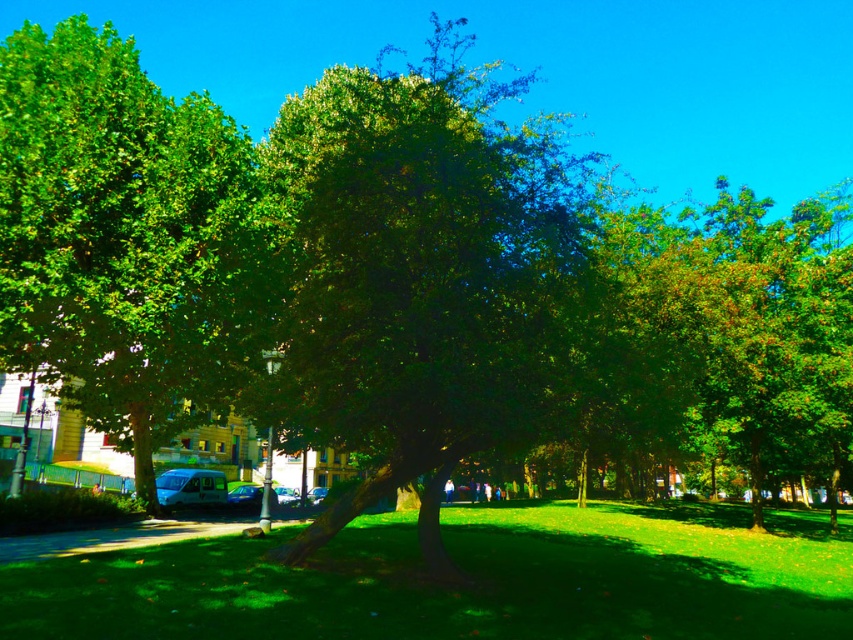
Question: Which object is closer to the camera taking this photo?

Choices:
 (A) green grassy at center
 (B) metallic silver car at center
 (C) green leafy tree at center

Answer: (A)

Question: Which point is closer to the camera?

Choices:
 (A) (236, 288)
 (B) (206, 474)
 (C) (296, 493)

Answer: (A)

Question: Can you confirm if metallic silver van at lower left is positioned to the right of metallic silver car at center?

Choices:
 (A) yes
 (B) no

Answer: (B)

Question: Does green leafy tree at center appear on the left side of metallic silver car at center?

Choices:
 (A) yes
 (B) no

Answer: (B)

Question: Is metallic silver van at lower left wider than metallic silver car at center?

Choices:
 (A) no
 (B) yes

Answer: (B)

Question: Estimate the real-world distances between objects in this image. Which object is closer to the metallic silver car at center?

Choices:
 (A) green grassy at center
 (B) green leafy tree at center
 (C) metallic silver van at lower left

Answer: (C)